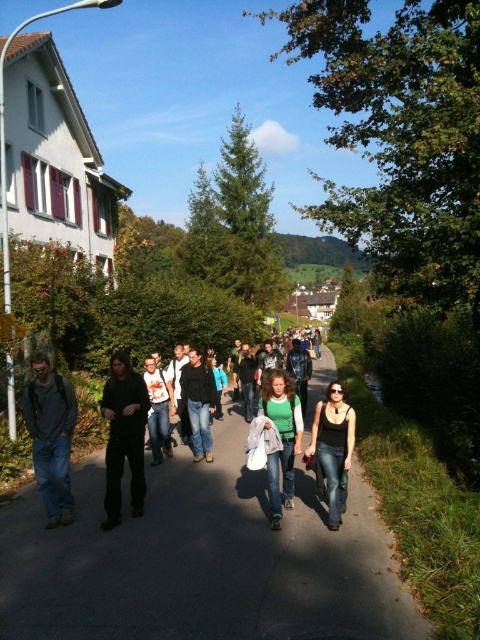
Question: Does gray asphalt pavement at center come in front of green matte shirt at center?

Choices:
 (A) no
 (B) yes

Answer: (B)

Question: Considering the relative positions of dark matte clothing at center and white cotton shirt at center in the image provided, where is dark matte clothing at center located with respect to white cotton shirt at center?

Choices:
 (A) above
 (B) below

Answer: (A)

Question: Among these points, which one is farthest from the camera?

Choices:
 (A) (335, 467)
 (B) (64, 502)

Answer: (B)

Question: Is the position of matte gray backpack at left less distant than that of green matte shirt at center?

Choices:
 (A) yes
 (B) no

Answer: (B)

Question: Which object is positioned farthest from the black matte tank top at center?

Choices:
 (A) green matte shirt at center
 (B) dark matte clothing at center

Answer: (B)

Question: Among these objects, which one is nearest to the camera?

Choices:
 (A) matte gray backpack at left
 (B) gray asphalt pavement at center
 (C) black matte tank top at center
 (D) dark blue jeans at center

Answer: (B)